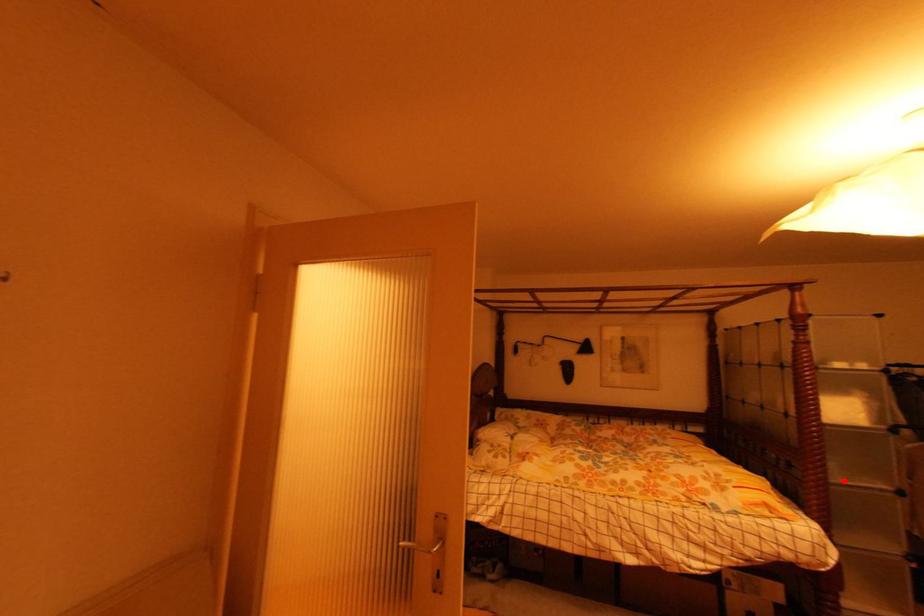
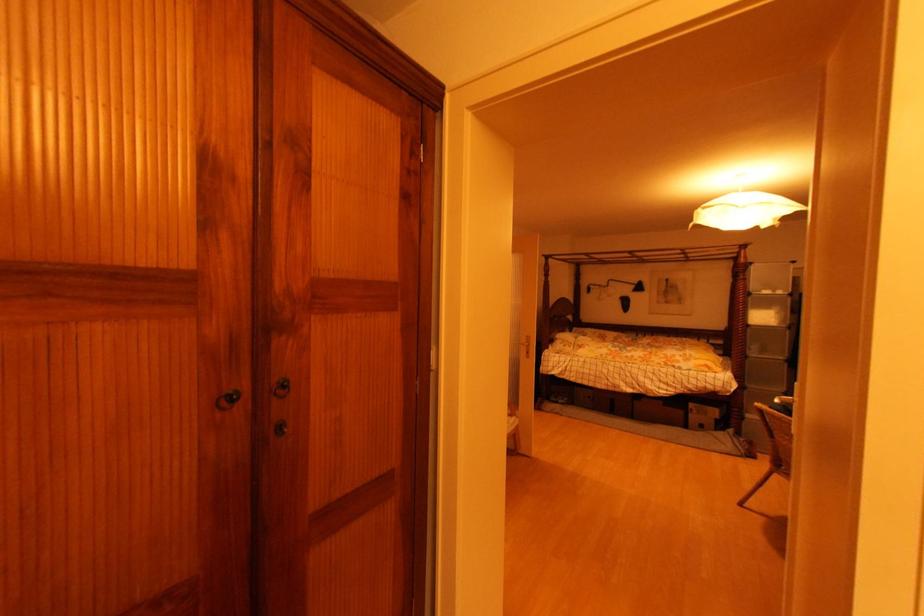
Where in the second image is the point corresponding to the highlighted location from the first image?

(759, 355)